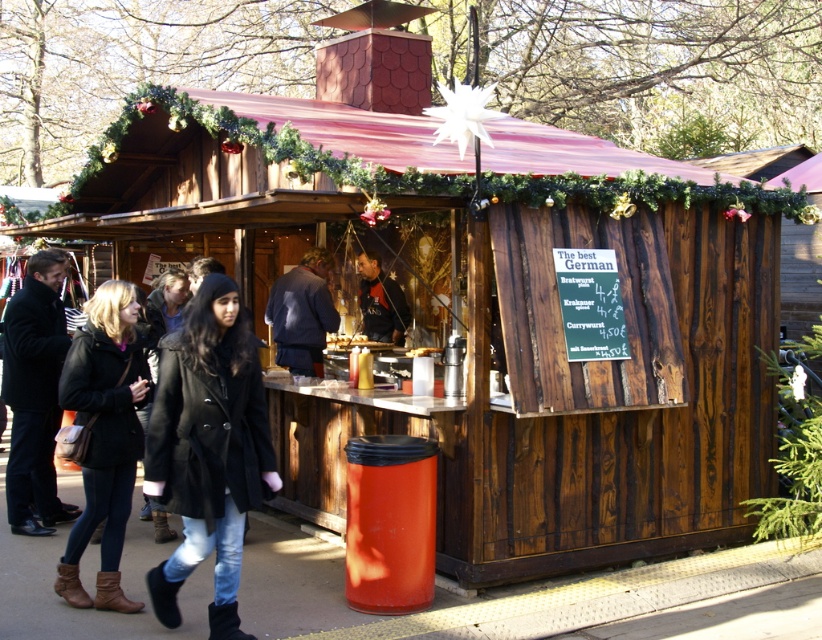
Does black wool coat at left have a smaller size compared to dark blue fabric jacket at center?

Actually, black wool coat at left might be larger than dark blue fabric jacket at center.

The width and height of the screenshot is (822, 640). Find the location of `black wool coat at left`. black wool coat at left is located at coordinates (35, 394).

Find the location of a particular element. black wool coat at left is located at coordinates (35, 394).

Is black wool coat at left below dark blue jacket at center?

Yes, black wool coat at left is below dark blue jacket at center.

Does black wool coat at left come behind dark blue jacket at center?

No, it is not.

Identify the location of black wool coat at left. The image size is (822, 640). (35, 394).

Locate an element on the screen. The width and height of the screenshot is (822, 640). black wool coat at left is located at coordinates (35, 394).

Does matte black coat at lower left appear on the left side of black wool coat at left?

In fact, matte black coat at lower left is to the right of black wool coat at left.

Who is taller, matte black coat at lower left or black wool coat at left?

Standing taller between the two is black wool coat at left.

Is point (123, 600) farther from camera compared to point (59, 362)?

No, (123, 600) is closer to viewer.

The height and width of the screenshot is (640, 822). Find the location of `matte black coat at lower left`. matte black coat at lower left is located at coordinates (104, 436).